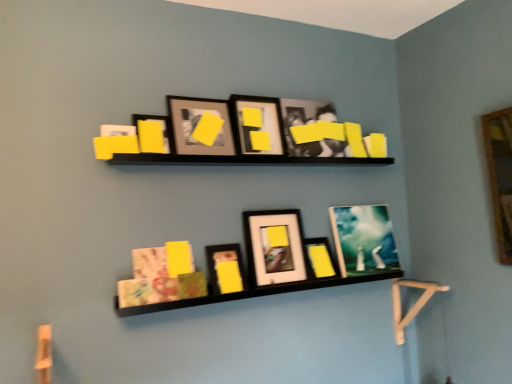
Question: Based on their sizes in the image, would you say matte black picture frame at center, the second picture frame from the right, is bigger or smaller than matte black picture frame at upper center, acting as the eighth picture frame starting from the right?

Choices:
 (A) small
 (B) big

Answer: (B)

Question: In the image, is matte black picture frame at center, the second picture frame from the right, positioned in front of or behind matte black picture frame at upper center, acting as the eighth picture frame starting from the right?

Choices:
 (A) front
 (B) behind

Answer: (B)

Question: Which is farther from the matte paper book at lower center?

Choices:
 (A) matte black picture frame at upper center, the first picture frame when ordered from left to right
 (B) matte black picture frame at upper center, the 5th picture frame from the right
 (C) matte glass picture frame at upper center, which is the first picture frame from right to left
 (D) matte black picture frame at center, acting as the 5th picture frame starting from the left
 (E) matte black picture frame at upper center, which is the seventh picture frame from right to left

Answer: (C)

Question: Which of these objects is positioned farthest from the matte black picture frame at center, the third picture frame in the left-to-right sequence?

Choices:
 (A) matte black picture frame at upper center, the 6th picture frame viewed from the left
 (B) black matte shelf at center
 (C) matte black picture frame at upper center, which appears as the second picture frame when viewed from the left
 (D) matte black picture frame at upper center, the first picture frame when ordered from left to right
 (E) matte black picture frame at upper center, the 5th picture frame from the right

Answer: (A)